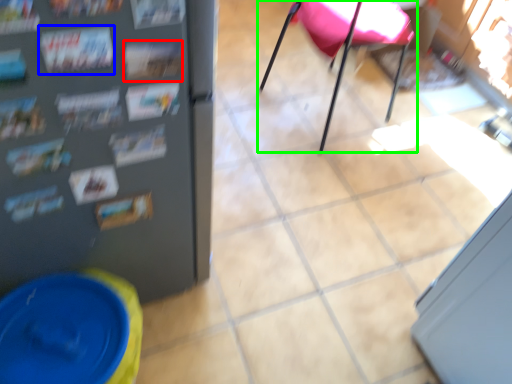
Question: Estimate the real-world distances between objects in this image. Which object is closer to magazine (highlighted by a red box), magazine (highlighted by a blue box) or chair (highlighted by a green box)?

Choices:
 (A) magazine
 (B) chair

Answer: (A)